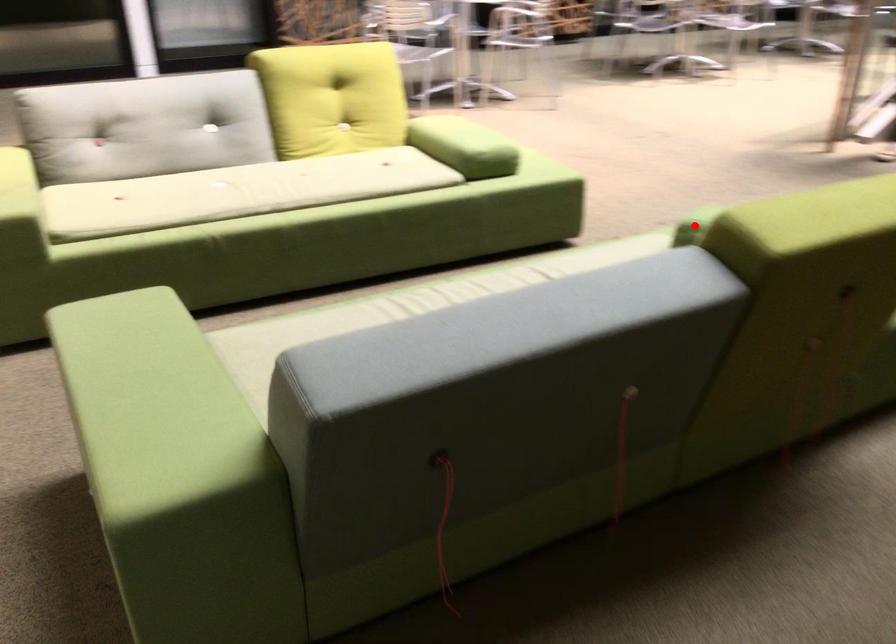
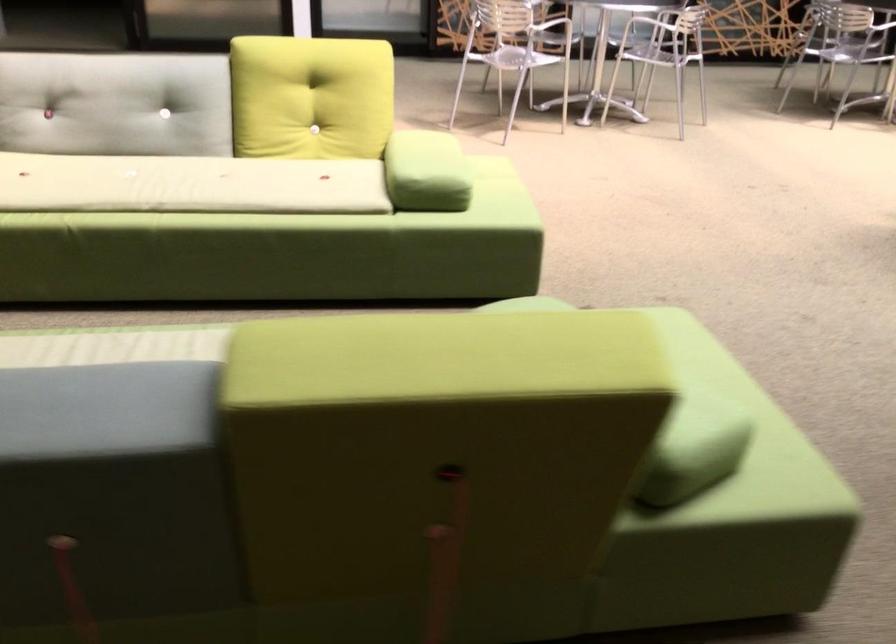
Question: I am providing you with two images of the same scene from different viewpoints. A red point is marked on the first image. Is the red point's position out of view in image 2?

Choices:
 (A) Yes
 (B) No

Answer: (A)